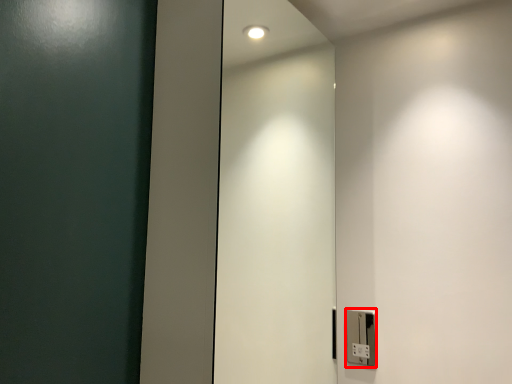
Question: Observing the image, what is the correct spatial positioning of light switch (annotated by the red box) in reference to elevator door?

Choices:
 (A) left
 (B) right

Answer: (B)